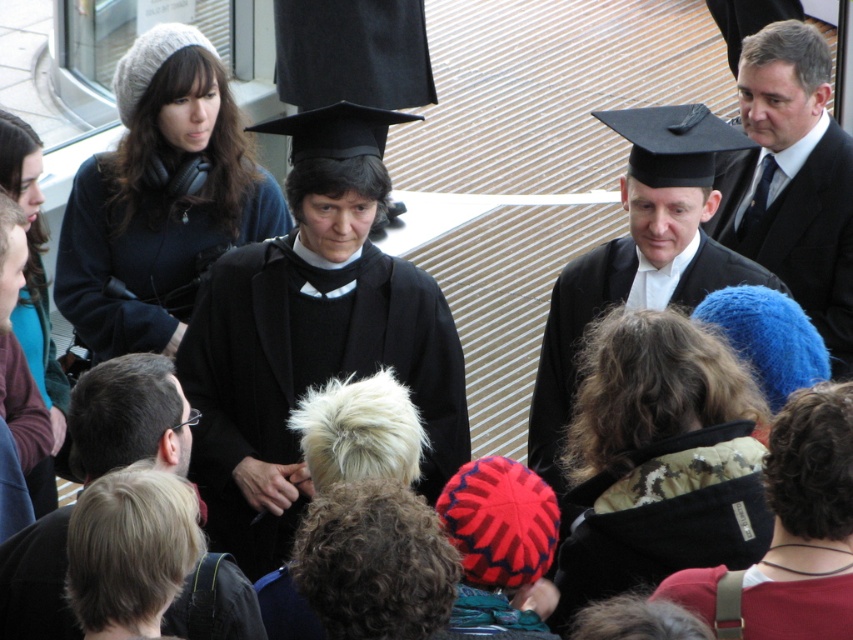
Question: Which point is farther from the camera taking this photo?

Choices:
 (A) click(x=376, y=276)
 (B) click(x=109, y=243)
 (C) click(x=668, y=120)
 (D) click(x=784, y=144)

Answer: (D)

Question: Does black matte suit at upper right appear on the left side of black matte robe at upper center?

Choices:
 (A) no
 (B) yes

Answer: (A)

Question: Which point is farther from the camera taking this photo?

Choices:
 (A) (793, 170)
 (B) (270, 396)
 (C) (142, 316)
 (D) (747, 138)

Answer: (A)

Question: Can you confirm if black matte robe at center is positioned above black matte suit at upper right?

Choices:
 (A) no
 (B) yes

Answer: (A)

Question: Is matte black graduation gown at center positioned before black matte suit at upper right?

Choices:
 (A) no
 (B) yes

Answer: (B)

Question: Which point is closer to the camera?

Choices:
 (A) matte black graduation gown at center
 (B) black matte robe at upper center
 (C) black matte suit at upper right

Answer: (A)